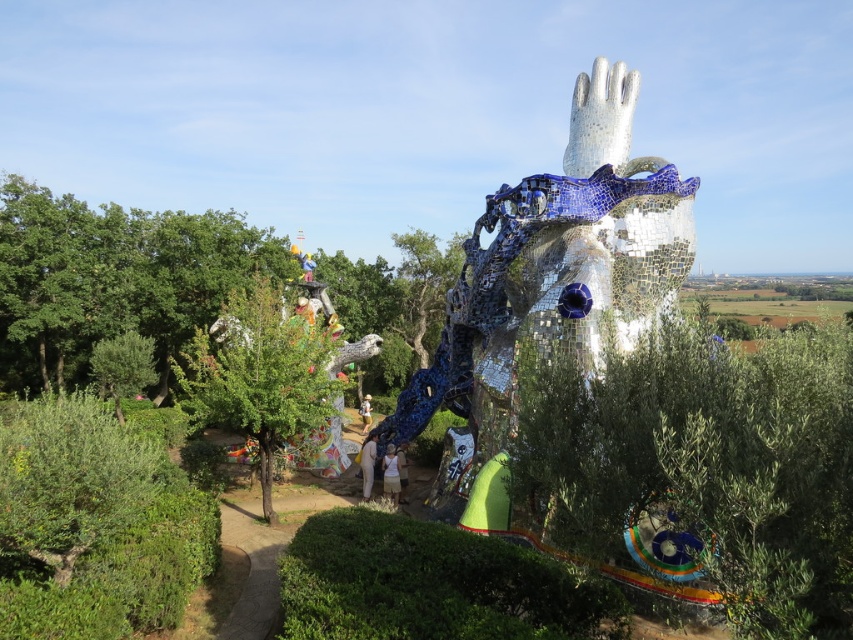
Is green leafy olive tree at center shorter than camouflage fabric shirt at center?

No.

Which is below, green leafy olive tree at center or camouflage fabric shirt at center?

Positioned lower is camouflage fabric shirt at center.

Which is behind, point (241, 410) or point (367, 419)?

Positioned behind is point (367, 419).

Locate an element on the screen. This screenshot has width=853, height=640. green leafy olive tree at center is located at coordinates (264, 378).

Between point (21, 598) and point (184, 371), which one is positioned behind?

The point (184, 371) is behind.

Which is more to the left, green leafy hedge at lower left or green leafy olive tree at center?

From the viewer's perspective, green leafy hedge at lower left appears more on the left side.

The width and height of the screenshot is (853, 640). In order to click on green leafy hedge at lower left in this screenshot , I will do `click(96, 524)`.

Which is in front, point (32, 413) or point (532, 580)?

Point (532, 580) is more forward.

Does green leafy hedge at lower left have a larger size compared to green leafy hedge at lower center?

Indeed, green leafy hedge at lower left has a larger size compared to green leafy hedge at lower center.

Between point (20, 580) and point (412, 612), which one is positioned in front?

Point (412, 612) is in front.

Find the location of `green leafy hedge at lower left`. green leafy hedge at lower left is located at coordinates (96, 524).